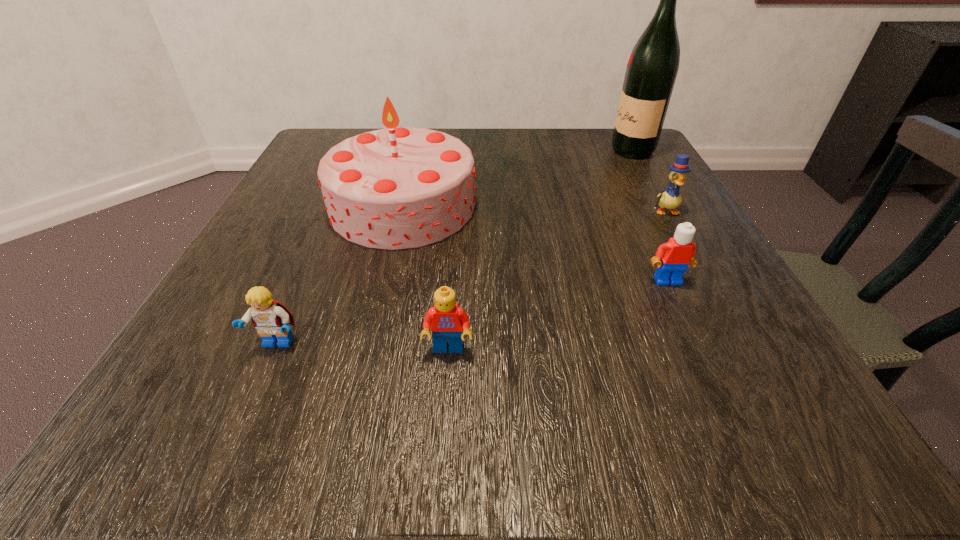
This screenshot has height=540, width=960. Find the location of `vacant area between the second Lego from left to right and the birthday cake`. vacant area between the second Lego from left to right and the birthday cake is located at coordinates (425, 276).

Image resolution: width=960 pixels, height=540 pixels. Find the location of `free space between the second Lego from left to right and the leftmost Lego`. free space between the second Lego from left to right and the leftmost Lego is located at coordinates (363, 346).

Identify the location of object that is the second nearest to the leftmost Lego. (395, 188).

Where is `object that is the second closest to the third nearest object`? object that is the second closest to the third nearest object is located at coordinates tap(395, 188).

Identify which Lego is the closest to the farthest object. Please provide its 2D coordinates. Your answer should be formatted as a tuple, i.e. [(x, y)], where the tuple contains the x and y coordinates of a point satisfying the conditions above.

[(676, 255)]

At what (x,y) coordinates should I click in order to perform the action: click on the third closest Lego to the farthest object. Please return your answer as a coordinate pair (x, y). This screenshot has width=960, height=540. Looking at the image, I should click on (271, 318).

This screenshot has height=540, width=960. I want to click on free space that satisfies the following two spatial constraints: 1. on the front-facing side of the tallest object; 2. on the face of the duckling, where the monocle is placed, so click(666, 211).